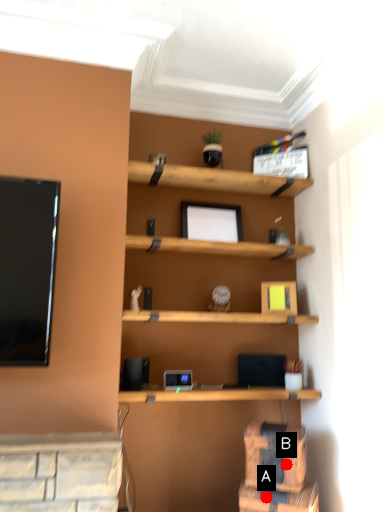
Question: Two points are circled on the image, labeled by A and B beside each circle. Which point is farther to the camera?

Choices:
 (A) A is further
 (B) B is further

Answer: (B)